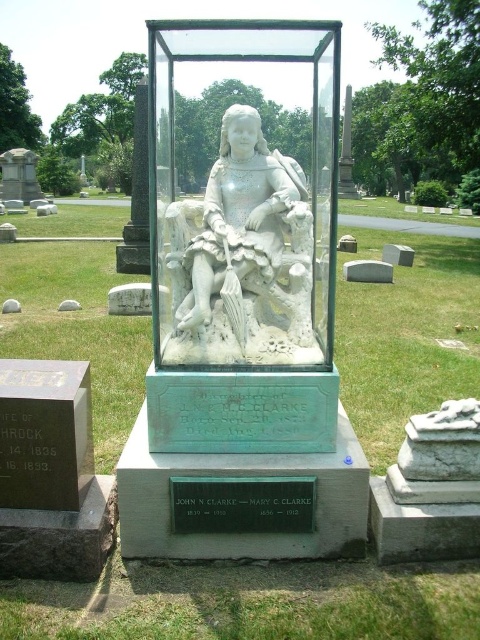
You are a historian visiting the cemetery and want to take a photo of both the white marble statue at center and the black metal plaque at center. Since you can only focus on one object at a time, which one should you focus on first to ensure the other is still in the frame?

The white marble statue at center is positioned on the left side of black metal plaque at center, so you should focus on the white marble statue at center first to keep the black metal plaque at center in the frame.

You are standing in front of the monument in the cemetery scene. There are two points marked on the monument base. The first point is at coordinates point [153,76] and the second at point [278,512]. If you want to touch the closest point to you on the monument base, which coordinate should you aim for?

The point at coordinates point [153,76] is closer to the viewer than point [278,512], so you should aim for point [153,76].